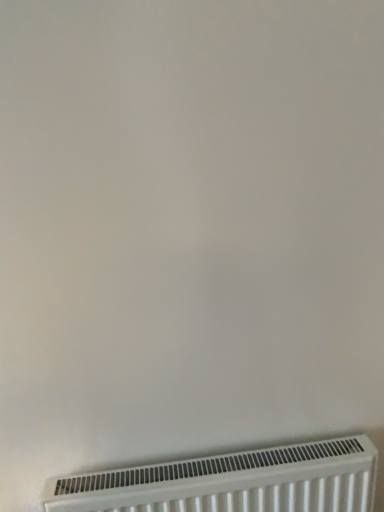
Locate an element on the screen. Image resolution: width=384 pixels, height=512 pixels. white plastic radiator at bottom is located at coordinates (233, 482).

What do you see at coordinates (233, 482) in the screenshot? This screenshot has height=512, width=384. I see `white plastic radiator at bottom` at bounding box center [233, 482].

Locate an element on the screen. This screenshot has height=512, width=384. white plastic radiator at bottom is located at coordinates (233, 482).